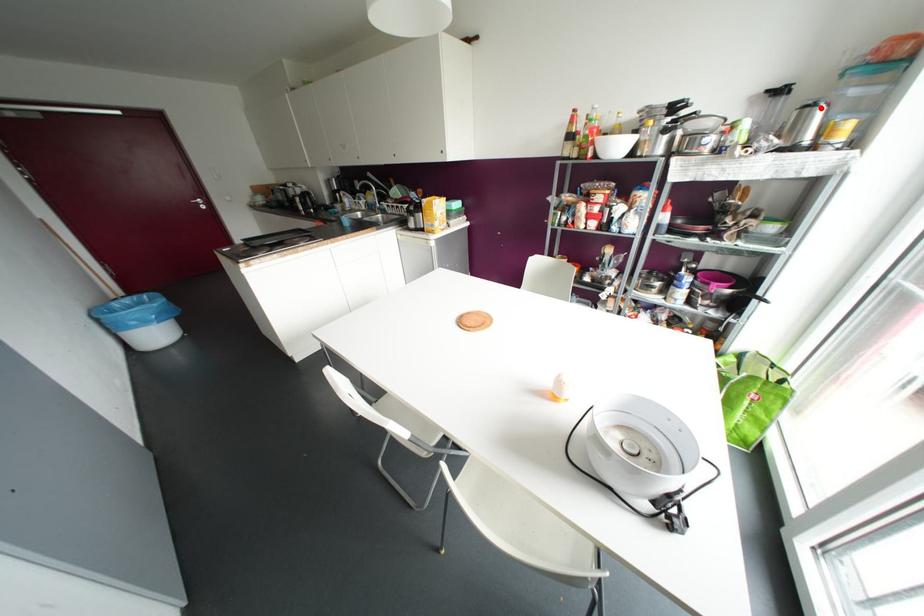
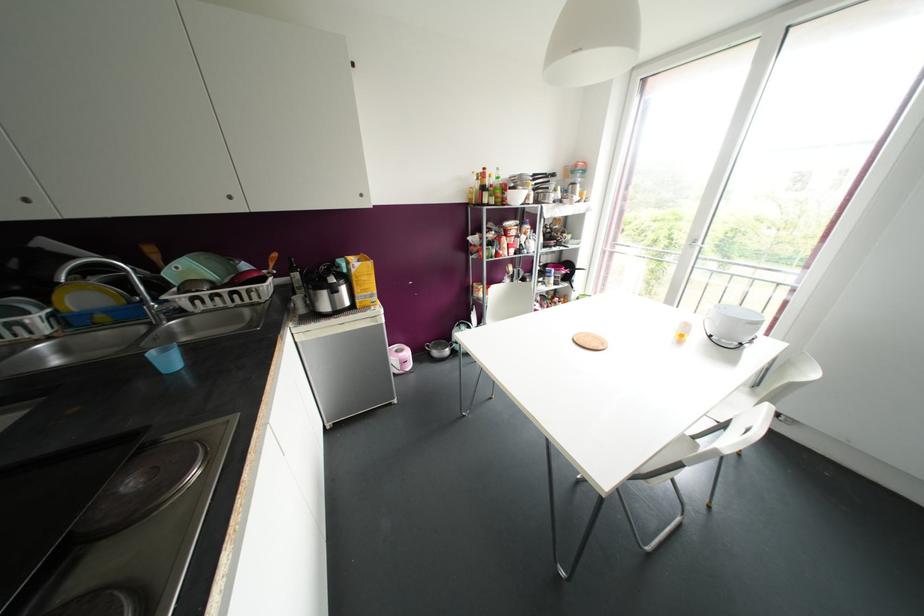
Question: A red point is marked in image1. In image2, is the corresponding 3D point closer to the camera or farther? Reply with the corresponding letter.

Choices:
 (A) The corresponding 3D point is closer.
 (B) The corresponding 3D point is farther.

Answer: (A)